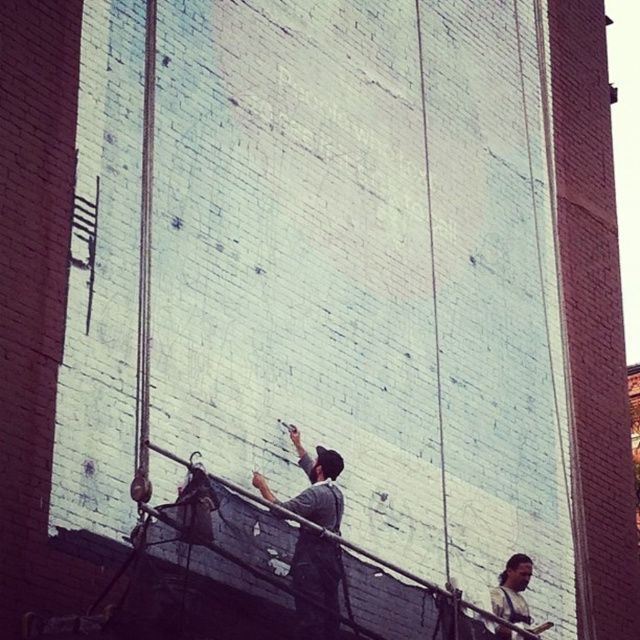
You are observing two workers on a brick wall. You see a dark gray fabric at center and a dark brown leather jacket at lower right. Which object is nearer to you?

The dark gray fabric at center is closer to the viewer than the dark brown leather jacket at lower right.